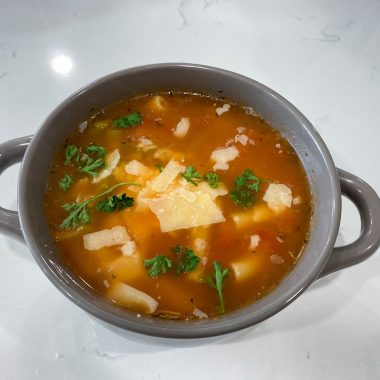
The height and width of the screenshot is (380, 380). I want to click on counter, so click(x=40, y=86).